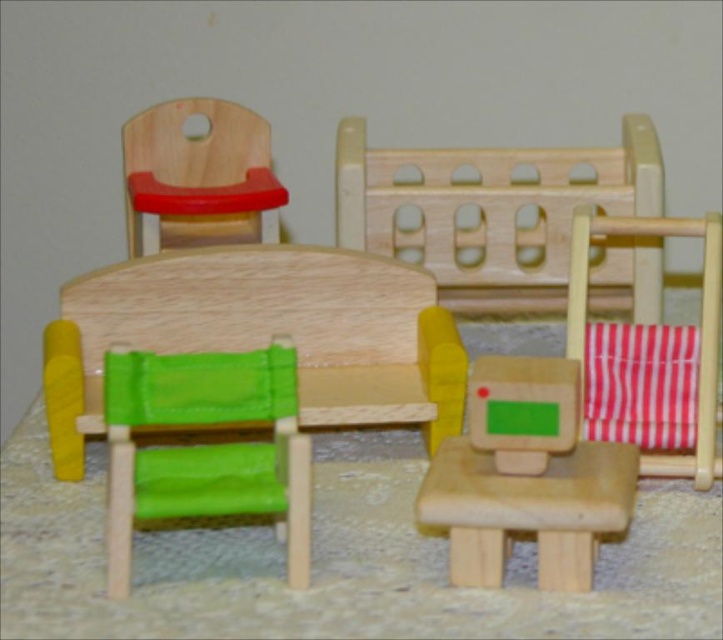
Question: Is green fabric table at center bigger than matte wood chair at upper left?

Choices:
 (A) no
 (B) yes

Answer: (B)

Question: Considering the real-world distances, which object is farthest from the matte wooden chair at center?

Choices:
 (A) red striped fabric chair at right
 (B) matte wood chair at upper left
 (C) green fabric chair at center

Answer: (B)

Question: Which object appears farthest from the camera in this image?

Choices:
 (A) red striped fabric chair at right
 (B) matte wood chair at upper left

Answer: (B)

Question: Which point is farther to the camera?

Choices:
 (A) (633, 412)
 (B) (355, 362)
 (C) (128, 154)

Answer: (C)

Question: Can you confirm if green fabric table at center is bigger than matte wooden chair at center?

Choices:
 (A) no
 (B) yes

Answer: (B)

Question: Can you confirm if red striped fabric chair at right is positioned below matte wood chair at upper left?

Choices:
 (A) yes
 (B) no

Answer: (A)